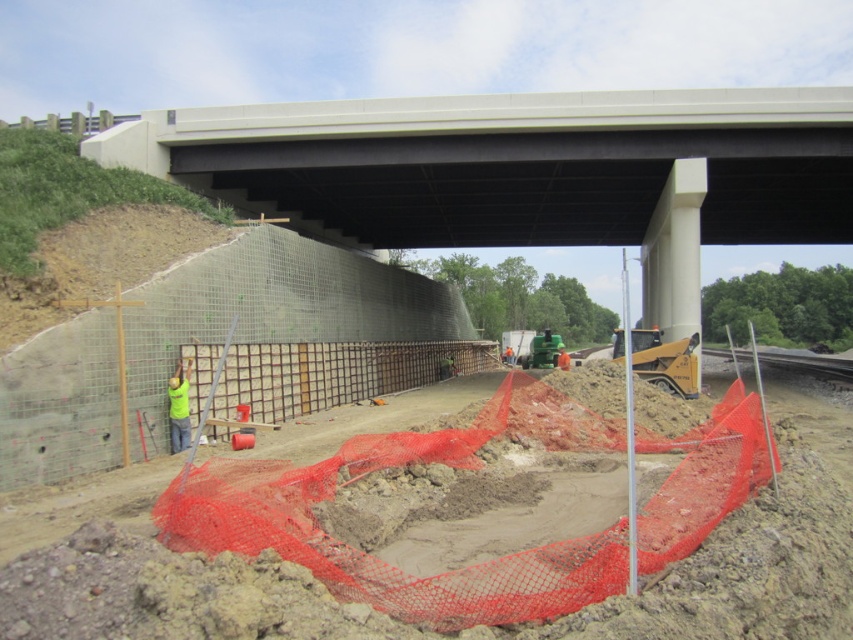
Does gray concrete train track at lower right have a greater height compared to yellow reflective vest at center?

Yes.

Is point (798, 349) farther from camera compared to point (173, 422)?

Yes, point (798, 349) is behind point (173, 422).

Does point (792, 362) lie behind point (173, 413)?

Yes, it is behind point (173, 413).

Image resolution: width=853 pixels, height=640 pixels. I want to click on gray concrete train track at lower right, so click(807, 362).